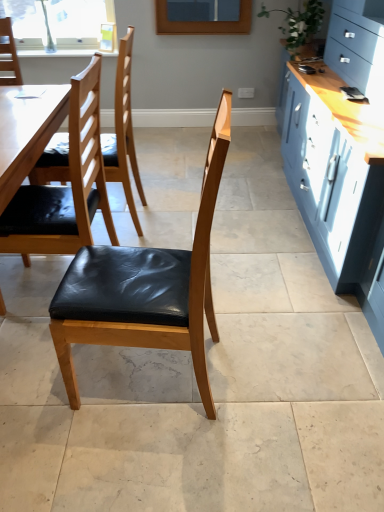
Question: Is point (81, 175) closer or farther from the camera than point (299, 45)?

Choices:
 (A) farther
 (B) closer

Answer: (B)

Question: Is black leather chair at left, positioned as the second chair in front-to-back order, wider or thinner than green leafy plant at upper right?

Choices:
 (A) wide
 (B) thin

Answer: (A)

Question: Which is nearer to the black leather chair at left, positioned as the second chair in front-to-back order?

Choices:
 (A) clear glass window at upper left
 (B) matte black leather chair at center, the 1th chair from the front
 (C) black leather chair at left, positioned as the 3th chair in front-to-back order
 (D) green leafy plant at upper right

Answer: (B)

Question: Considering the real-world distances, which object is closest to the clear glass window at upper left?

Choices:
 (A) matte black leather chair at center, positioned as the 3th chair in back-to-front order
 (B) black leather chair at left, positioned as the 3th chair in front-to-back order
 (C) green leafy plant at upper right
 (D) black leather chair at left, positioned as the second chair in front-to-back order

Answer: (B)